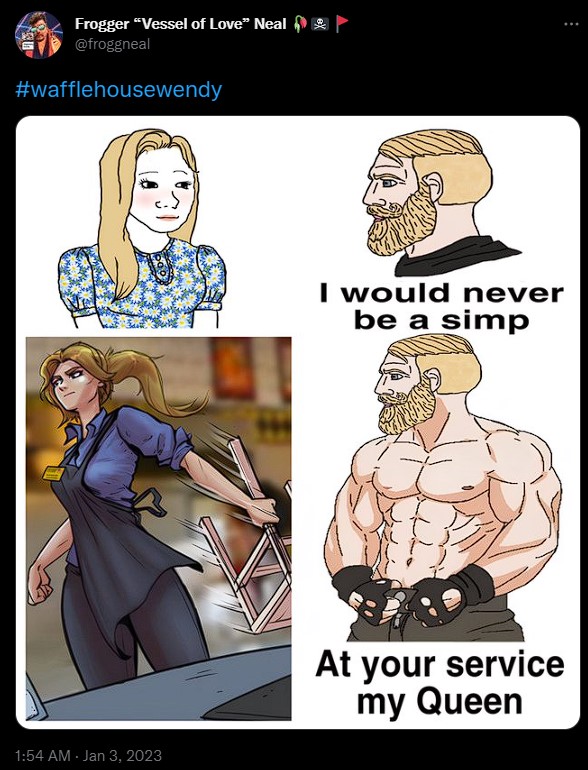
Where is `stool`? The image size is (588, 770). stool is located at coordinates (273, 611).